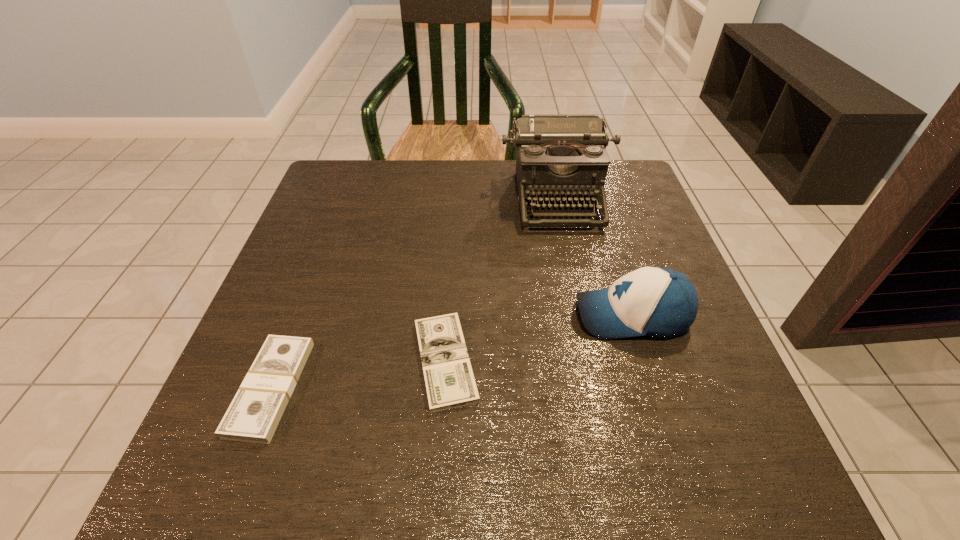
You are a GUI agent. You are given a task and a screenshot of the screen. Output one action in this format:
    pyautogui.click(x=<x>, y=<y>)
    Task: Click on the vacant point located between the third tallest object and the shortest object
    The image size is (960, 540).
    Given the screenshot: What is the action you would take?
    pyautogui.click(x=358, y=374)

I want to click on free area in between the typewriter and the shorter dollar, so click(x=501, y=279).

Identify the location of free area in between the farthest object and the left dollar. (414, 293).

Locate an element on the screen. This screenshot has height=540, width=960. unoccupied area between the tallest object and the baseball cap is located at coordinates (594, 256).

I want to click on free space between the third tallest object and the tallest object, so click(414, 293).

This screenshot has height=540, width=960. Identify the location of the second closest object to the third tallest object. (558, 156).

The width and height of the screenshot is (960, 540). I want to click on object that stands as the closest to the third object from right to left, so click(253, 416).

The image size is (960, 540). What are the coordinates of `vacant space that satisfies the following two spatial constraints: 1. on the front-facing side of the second tallest object; 2. on the front side of the leftmost object` in the screenshot? It's located at (655, 388).

This screenshot has width=960, height=540. I want to click on free spot that satisfies the following two spatial constraints: 1. on the front-facing side of the third shortest object; 2. on the front side of the shorter dollar, so click(x=646, y=361).

Find the location of a particular element. The width and height of the screenshot is (960, 540). free space that satisfies the following two spatial constraints: 1. on the back side of the left dollar; 2. on the left side of the right dollar is located at coordinates (281, 361).